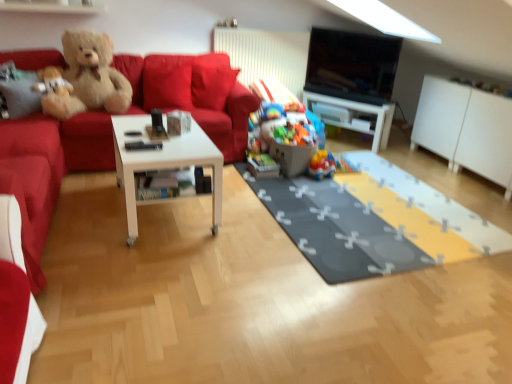
Where is `vacant area to the left of white matte cabinet at right`? This screenshot has width=512, height=384. vacant area to the left of white matte cabinet at right is located at coordinates (419, 163).